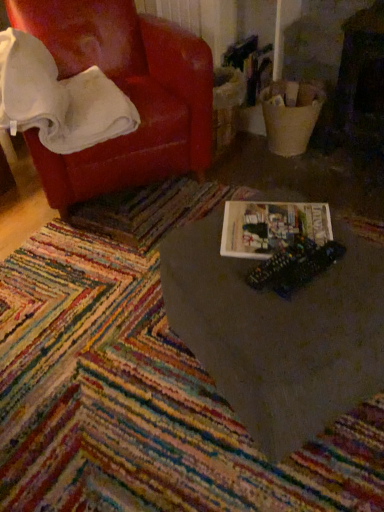
This screenshot has height=512, width=384. Find the location of `vacant space situated on the left part of white glossy book at center`. vacant space situated on the left part of white glossy book at center is located at coordinates (119, 372).